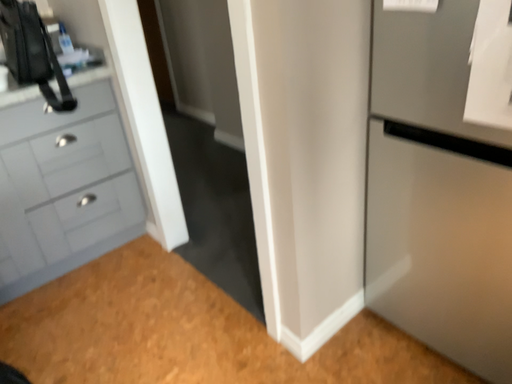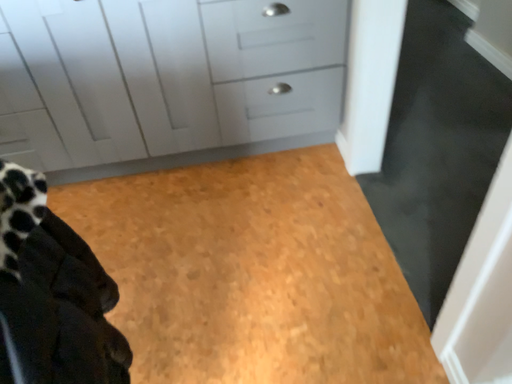
Question: How did the camera likely rotate when shooting the video?

Choices:
 (A) rotated downward
 (B) rotated upward

Answer: (A)